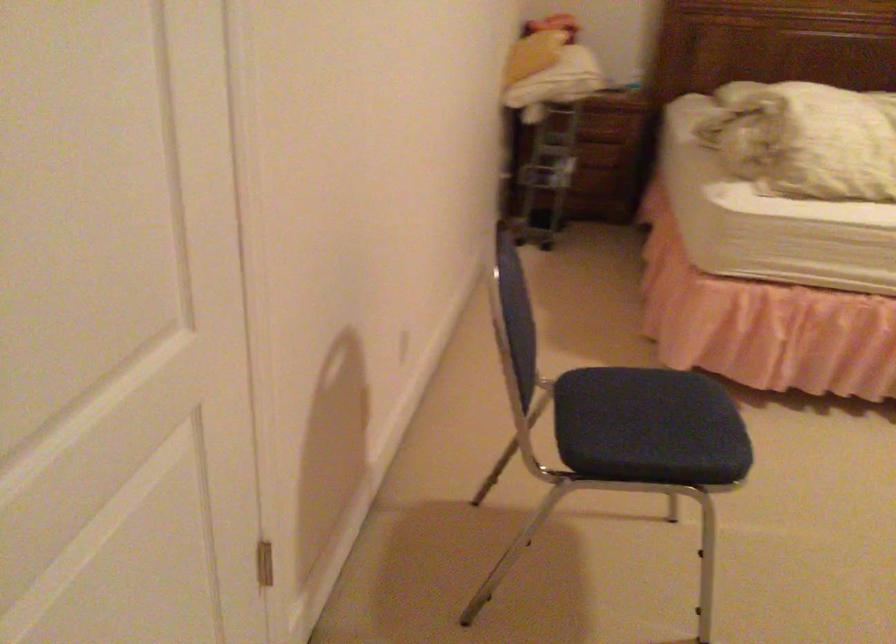
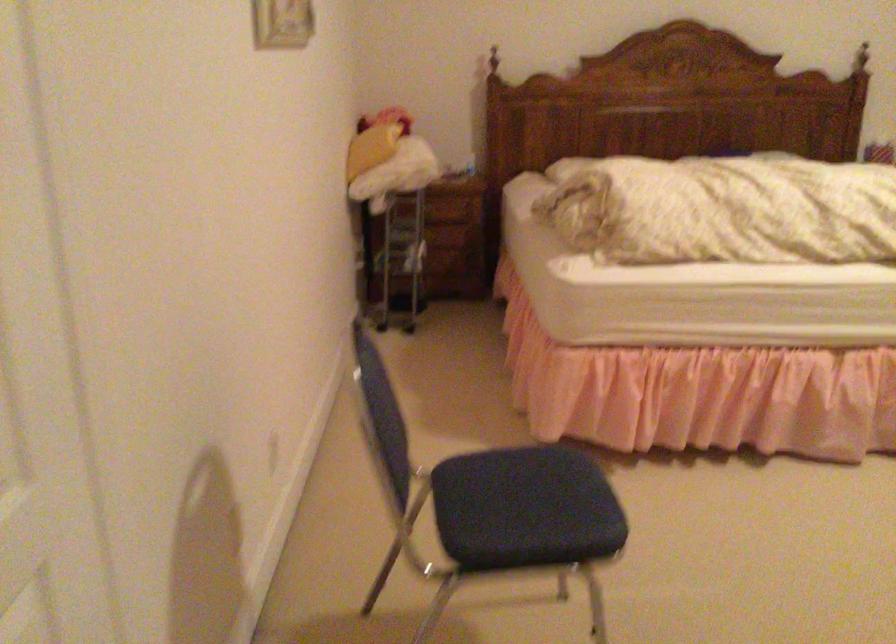
Question: The camera is either moving clockwise (left) or counter-clockwise (right) around the object. The first image is from the beginning of the video and the second image is from the end. Is the camera moving left or right when shooting the video?

Choices:
 (A) Left
 (B) Right

Answer: (A)